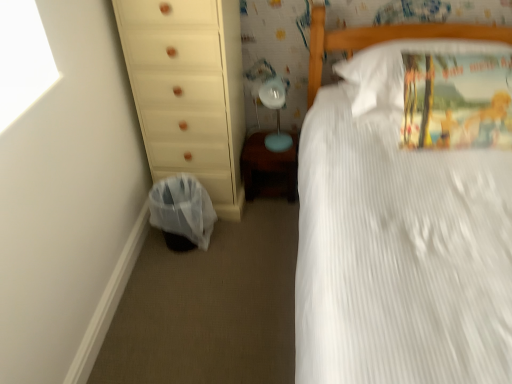
The height and width of the screenshot is (384, 512). I want to click on free space in front of plastic bag at lower left, so click(185, 277).